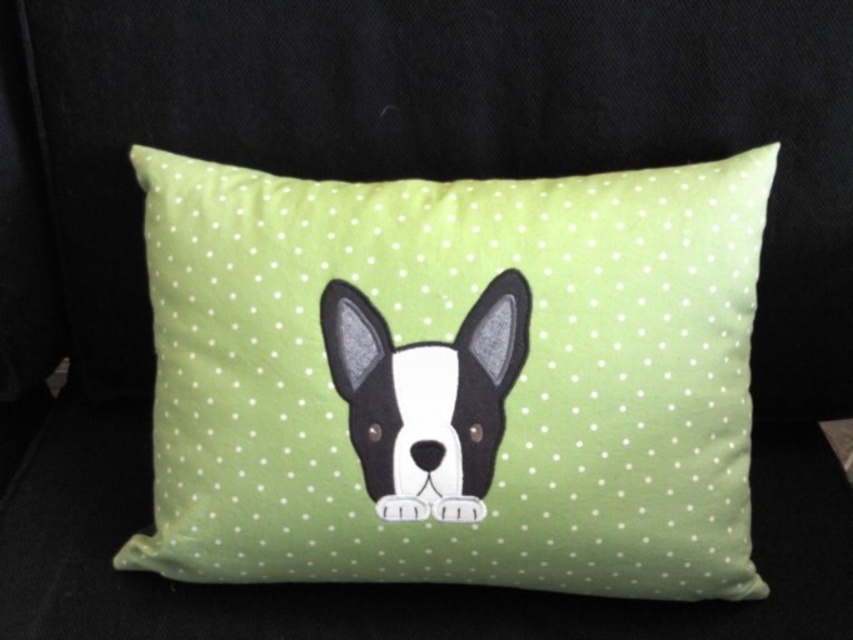
Looking at this image, you have a small toy mouse that is 2 inches long. You want to place it on the lime green fabric pillow with polka dots at center so that it touches the black felt dog at center. Is this possible?

The lime green fabric pillow with polka dots at center is 3.29 inches from the black felt dog at center. Since the toy mouse is 2 inches long, it is shorter than the distance between them. Therefore, placing the mouse to touch both objects isn

You are a photographer setting up for a product shoot. The camera is positioned to capture the lime green fabric pillow with polka dots at center. Given that the pillow is 37.61 inches away from the camera, will you need to adjust the focus ring to ensure the pillow is in sharp focus if your camera is currently set to auto focus at 40 inches?

The lime green fabric pillow with polka dots at center is 37.61 inches from the camera. Since the auto focus is set at 40 inches, the pillow is slightly closer than the current focus distance. You should adjust the focus ring to match the pillow distance of 37.61 inches for sharpness.

You are arranging a cozy living room and want to place the lime green fabric pillow with polka dots at center and the black felt dog at center on a small shelf. The shelf can only hold items that are not too big. Based on the scene, which item might not fit well on the shelf?

The lime green fabric pillow with polka dots at center has a larger size compared to the black felt dog at center, so it might not fit well on the shelf.